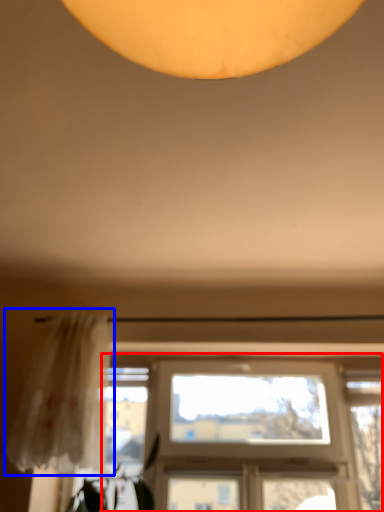
Question: Among these objects, which one is farthest to the camera, window (highlighted by a red box) or curtain (highlighted by a blue box)?

Choices:
 (A) window
 (B) curtain

Answer: (A)